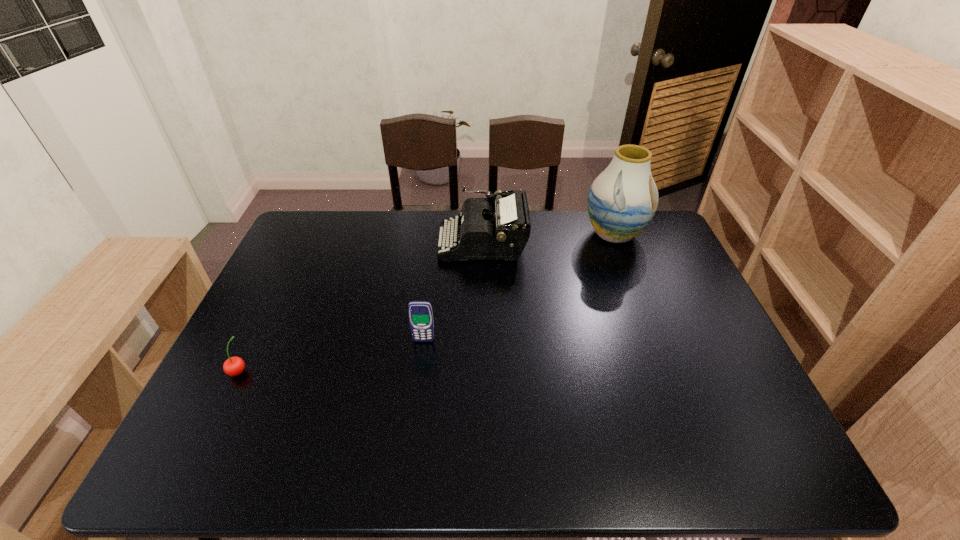
Identify the location of vacant area located 0.230m on the front-facing side of the cellular telephone. The height and width of the screenshot is (540, 960). (414, 422).

The image size is (960, 540). In order to click on vacant space located on the right of the shortest object in this screenshot , I will do `click(317, 370)`.

At what (x,y) coordinates should I click in order to perform the action: click on vase that is at the far edge. Please return your answer as a coordinate pair (x, y). This screenshot has width=960, height=540. Looking at the image, I should click on (622, 200).

This screenshot has width=960, height=540. I want to click on typewriter at the far edge, so click(x=487, y=233).

Image resolution: width=960 pixels, height=540 pixels. Identify the location of object situated at the left edge. (234, 366).

This screenshot has width=960, height=540. Identify the location of object positioned at the right edge. (622, 200).

Where is `object at the far right corner`? Image resolution: width=960 pixels, height=540 pixels. object at the far right corner is located at coordinates (622, 200).

In the image, there is a desktop. What are the coordinates of `vacant area at the far edge` in the screenshot? It's located at (594, 244).

Image resolution: width=960 pixels, height=540 pixels. In order to click on vacant space at the near edge in this screenshot , I will do `click(557, 471)`.

Locate an element on the screen. The height and width of the screenshot is (540, 960). free spot at the left edge of the desktop is located at coordinates (310, 302).